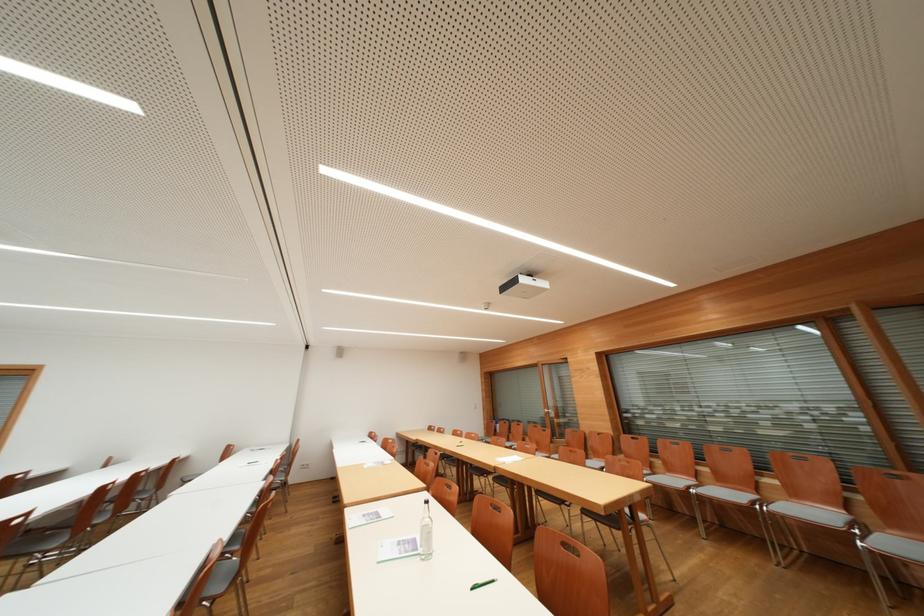
Describe the element at coordinates (426, 532) in the screenshot. I see `the glass water bottle` at that location.